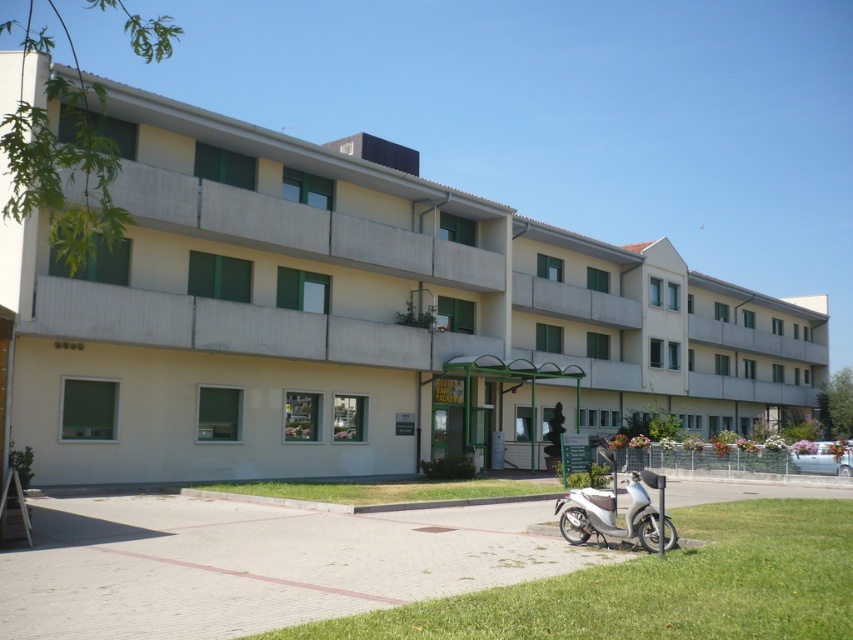
Is green grass at lower center bigger than silver metallic scooter at lower right?

Yes.

The height and width of the screenshot is (640, 853). What do you see at coordinates (387, 490) in the screenshot?
I see `green grass at lower center` at bounding box center [387, 490].

At what (x,y) coordinates should I click in order to perform the action: click on green grass at lower center. Please return your answer as a coordinate pair (x, y). This screenshot has width=853, height=640. Looking at the image, I should click on (387, 490).

The image size is (853, 640). I want to click on green grass at lower center, so point(387,490).

Can you confirm if beige concrete building at center is shorter than green grass at lower right?

Incorrect, beige concrete building at center's height does not fall short of green grass at lower right's.

Looking at this image, can you confirm if beige concrete building at center is thinner than green grass at lower right?

No, beige concrete building at center is not thinner than green grass at lower right.

Which is in front, point (643, 397) or point (805, 612)?

Point (805, 612) is in front.

Where is `beige concrete building at center`? This screenshot has width=853, height=640. beige concrete building at center is located at coordinates (357, 321).

Does green grass at lower right have a lesser height compared to silver metallic scooter at lower right?

No.

Who is lower down, green grass at lower right or silver metallic scooter at lower right?

green grass at lower right is lower down.

You are a GUI agent. You are given a task and a screenshot of the screen. Output one action in this format:
    pyautogui.click(x=<x>, y=<y>)
    Task: Click on the green grass at lower right
    
    Given the screenshot: What is the action you would take?
    pyautogui.click(x=659, y=588)